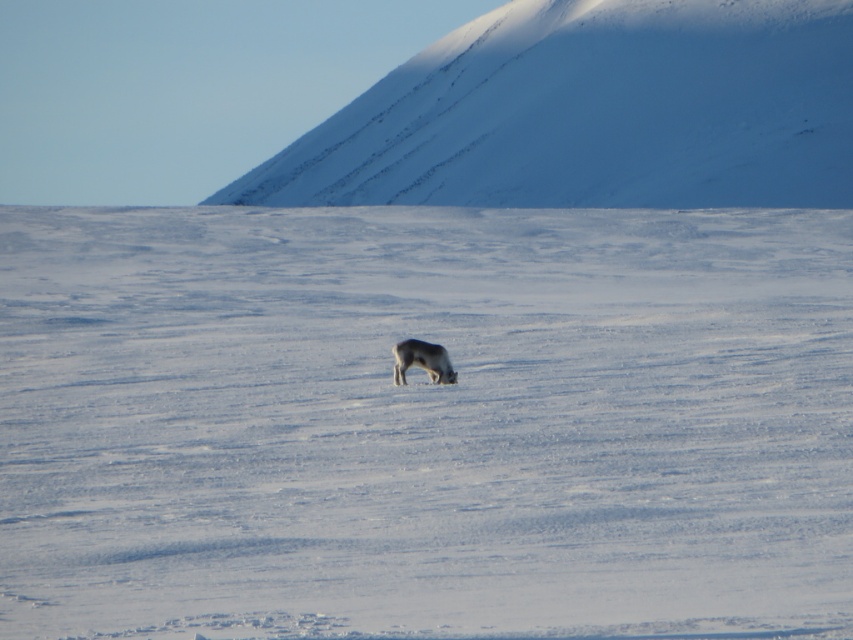
Does white fluffy snow at center lie behind furry white reindeer at center?

No, it is in front of furry white reindeer at center.

Which is in front, point (572, 422) or point (433, 364)?

Point (572, 422) is in front.

Locate an element on the screen. The height and width of the screenshot is (640, 853). white fluffy snow at center is located at coordinates pos(424,420).

Who is positioned more to the right, snowy white mountain at upper center or furry white reindeer at center?

Positioned to the right is furry white reindeer at center.

Who is higher up, snowy white mountain at upper center or furry white reindeer at center?

snowy white mountain at upper center is above.

Is point (671, 76) behind point (401, 376)?

Yes.

Where is `snowy white mountain at upper center`? snowy white mountain at upper center is located at coordinates (593, 113).

Is white fluffy snow at center closer to camera compared to snowy white mountain at upper center?

Yes, white fluffy snow at center is closer to the viewer.

Can you confirm if white fluffy snow at center is wider than snowy white mountain at upper center?

In fact, white fluffy snow at center might be narrower than snowy white mountain at upper center.

Who is more forward, (111, 582) or (672, 193)?

Positioned in front is point (111, 582).

Find the location of a particular element. The image size is (853, 640). white fluffy snow at center is located at coordinates (424, 420).